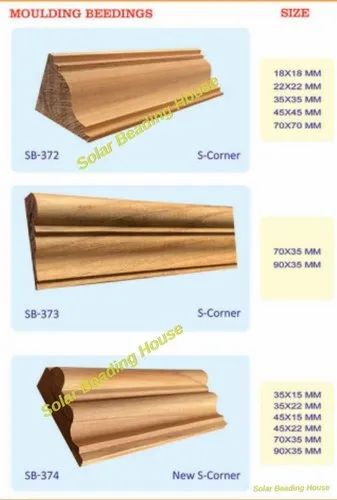
Find the location of `wood slabs`. wood slabs is located at coordinates (117, 414), (130, 251), (113, 101).